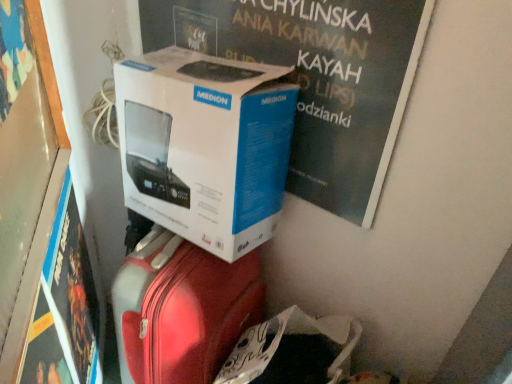
What do you see at coordinates (64, 307) in the screenshot? The height and width of the screenshot is (384, 512). I see `matte black magazine at lower left, which appears as the second magazine when viewed from the right` at bounding box center [64, 307].

Find the location of `white cardboard box at upper center, positioned as the second magazine in bottom-to-top order`. white cardboard box at upper center, positioned as the second magazine in bottom-to-top order is located at coordinates coord(317,79).

Is wooden frame at left oriented away from white cardboard box at upper center, which is counted as the 2th magazine, starting from the left?

Yes, wooden frame at left's orientation is away from white cardboard box at upper center, which is counted as the 2th magazine, starting from the left.

What are the coordinates of `bulletin board in front of the white cardboard box at upper center, which is counted as the 2th magazine, starting from the left` in the screenshot? It's located at (27, 182).

Is point (18, 165) positioned after point (367, 95)?

No, it is in front of (367, 95).

Considering the relative sizes of wooden frame at left and white cardboard box at upper center, arranged as the first magazine when viewed from the top, in the image provided, is wooden frame at left thinner than white cardboard box at upper center, arranged as the first magazine when viewed from the top,?

No.

Which object is further away from the camera taking this photo, white cardboard box at center or white cardboard box at upper center, arranged as the first magazine when viewed from the top?

white cardboard box at center is more distant.

From a real-world perspective, is white cardboard box at center positioned above or below white cardboard box at upper center, positioned as the second magazine in bottom-to-top order?

white cardboard box at center is situated lower than white cardboard box at upper center, positioned as the second magazine in bottom-to-top order, in the real world.

Do you think white cardboard box at center is within white cardboard box at upper center, which is counted as the 2th magazine, starting from the left, or outside of it?

white cardboard box at center cannot be found inside white cardboard box at upper center, which is counted as the 2th magazine, starting from the left.

How far apart are white cardboard box at center and white cardboard box at upper center, positioned as the second magazine in bottom-to-top order?

A distance of 16.68 centimeters exists between white cardboard box at center and white cardboard box at upper center, positioned as the second magazine in bottom-to-top order.

Does matte black magazine at lower left, the 1th magazine from the left, have a greater width compared to white cardboard box at center?

In fact, matte black magazine at lower left, the 1th magazine from the left, might be narrower than white cardboard box at center.

From a real-world perspective, is matte black magazine at lower left, the 1th magazine from the left, positioned under white cardboard box at center based on gravity?

Indeed, from a real-world perspective, matte black magazine at lower left, the 1th magazine from the left, is positioned beneath white cardboard box at center.

Is matte black magazine at lower left, the 1th magazine from the left, taller than white cardboard box at center?

Yes, matte black magazine at lower left, the 1th magazine from the left, is taller than white cardboard box at center.

Considering the sizes of objects white cardboard box at upper center, which is counted as the 2th magazine, starting from the left, and wooden frame at left in the image provided, who is bigger, white cardboard box at upper center, which is counted as the 2th magazine, starting from the left, or wooden frame at left?

wooden frame at left is bigger.

Are white cardboard box at upper center, which is counted as the 2th magazine, starting from the left, and wooden frame at left making contact?

No, white cardboard box at upper center, which is counted as the 2th magazine, starting from the left, is not in contact with wooden frame at left.

Could you measure the distance between white cardboard box at upper center, arranged as the first magazine when viewed from the top, and wooden frame at left?

19.07 inches.

How many degrees apart are the facing directions of white cardboard box at upper center, arranged as the first magazine when viewed from the top, and wooden frame at left?

There is a 140-degree angle between the facing directions of white cardboard box at upper center, arranged as the first magazine when viewed from the top, and wooden frame at left.

Which object is more forward, wooden frame at left or white cardboard box at center?

wooden frame at left is more forward.

Would you say wooden frame at left is inside or outside white cardboard box at center?

wooden frame at left is spatially situated outside white cardboard box at center.

Is wooden frame at left facing away from white cardboard box at center?

Yes.

Does wooden frame at left appear on the right side of white cardboard box at center?

No.

Between white cardboard box at center and matte black magazine at lower left, which ranks as the first magazine in bottom-to-top order, which one has smaller width?

matte black magazine at lower left, which ranks as the first magazine in bottom-to-top order, is thinner.

How far apart are white cardboard box at center and matte black magazine at lower left, which is the second magazine in top-to-bottom order?

12.32 inches.

Is white cardboard box at center not inside matte black magazine at lower left, which ranks as the first magazine in bottom-to-top order?

white cardboard box at center is positioned outside matte black magazine at lower left, which ranks as the first magazine in bottom-to-top order.

What's the angular difference between white cardboard box at center and matte black magazine at lower left, which ranks as the first magazine in bottom-to-top order,'s facing directions?

140 degrees separate the facing orientations of white cardboard box at center and matte black magazine at lower left, which ranks as the first magazine in bottom-to-top order.

You are a GUI agent. You are given a task and a screenshot of the screen. Output one action in this format:
    pyautogui.click(x=<x>, y=<y>)
    Task: Click on the box below the white cardboard box at upper center, positioned as the second magazine in bottom-to-top order (from a real-world perspective)
    
    Given the screenshot: What is the action you would take?
    pyautogui.click(x=205, y=145)

Would you say white cardboard box at upper center, which is counted as the 2th magazine, starting from the left, is inside or outside white cardboard box at center?

white cardboard box at upper center, which is counted as the 2th magazine, starting from the left, cannot be found inside white cardboard box at center.

Which object is positioned more to the left, white cardboard box at upper center, positioned as the second magazine in bottom-to-top order, or white cardboard box at center?

white cardboard box at center.

From a real-world perspective, which object stands above the other?

From a 3D spatial view, white cardboard box at upper center, arranged as the first magazine when viewed from the top, is above.

In the image, there is a wooden frame at left. Where is `magazine above it (from the image's perspective)`? magazine above it (from the image's perspective) is located at coordinates (317, 79).

Where is `magazine that appears in front of the white cardboard box at center`? magazine that appears in front of the white cardboard box at center is located at coordinates (317, 79).

When comparing their distances from wooden frame at left, does white cardboard box at upper center, the first magazine from the right, or matte black magazine at lower left, which is the second magazine in top-to-bottom order, seem closer?

matte black magazine at lower left, which is the second magazine in top-to-bottom order, is closer to wooden frame at left.

When comparing their distances from matte black magazine at lower left, the 1th magazine from the left, does white cardboard box at center or white cardboard box at upper center, the first magazine from the right, seem further?

white cardboard box at upper center, the first magazine from the right, lies further to matte black magazine at lower left, the 1th magazine from the left, than the other object.

Which object lies further to the anchor point white cardboard box at center, matte black magazine at lower left, the 1th magazine from the left, or wooden frame at left?

Among the two, matte black magazine at lower left, the 1th magazine from the left, is located further to white cardboard box at center.

Which object lies nearer to the anchor point white cardboard box at center, wooden frame at left or white cardboard box at upper center, arranged as the first magazine when viewed from the top?

white cardboard box at upper center, arranged as the first magazine when viewed from the top, is positioned closer to the anchor white cardboard box at center.

Considering their positions, is white cardboard box at center positioned further to wooden frame at left than white cardboard box at upper center, which is counted as the 2th magazine, starting from the left?

white cardboard box at upper center, which is counted as the 2th magazine, starting from the left, lies further to wooden frame at left than the other object.

Estimate the real-world distances between objects in this image. Which object is closer to white cardboard box at upper center, positioned as the second magazine in bottom-to-top order, matte black magazine at lower left, which is the second magazine in top-to-bottom order, or wooden frame at left?

wooden frame at left is positioned closer to the anchor white cardboard box at upper center, positioned as the second magazine in bottom-to-top order.

From the image, which object appears to be nearer to white cardboard box at center, wooden frame at left or matte black magazine at lower left, which ranks as the first magazine in bottom-to-top order?

Among the two, wooden frame at left is located nearer to white cardboard box at center.

When comparing their distances from white cardboard box at center, does white cardboard box at upper center, arranged as the first magazine when viewed from the top, or wooden frame at left seem closer?

white cardboard box at upper center, arranged as the first magazine when viewed from the top, is closer to white cardboard box at center.

The image size is (512, 384). Identify the location of box between wooden frame at left and matte black magazine at lower left, which is the second magazine in top-to-bottom order, from front to back. tap(205, 145).

Locate an element on the screen. This screenshot has width=512, height=384. box between white cardboard box at upper center, which is counted as the 2th magazine, starting from the left, and matte black magazine at lower left, the 1th magazine from the left, in the up-down direction is located at coordinates (205, 145).

The width and height of the screenshot is (512, 384). In order to click on bulletin board between white cardboard box at upper center, which is counted as the 2th magazine, starting from the left, and matte black magazine at lower left, which ranks as the first magazine in bottom-to-top order, in the vertical direction in this screenshot , I will do `click(27, 182)`.

Where is `magazine located between wooden frame at left and white cardboard box at center in the depth direction`? The image size is (512, 384). magazine located between wooden frame at left and white cardboard box at center in the depth direction is located at coordinates (317, 79).